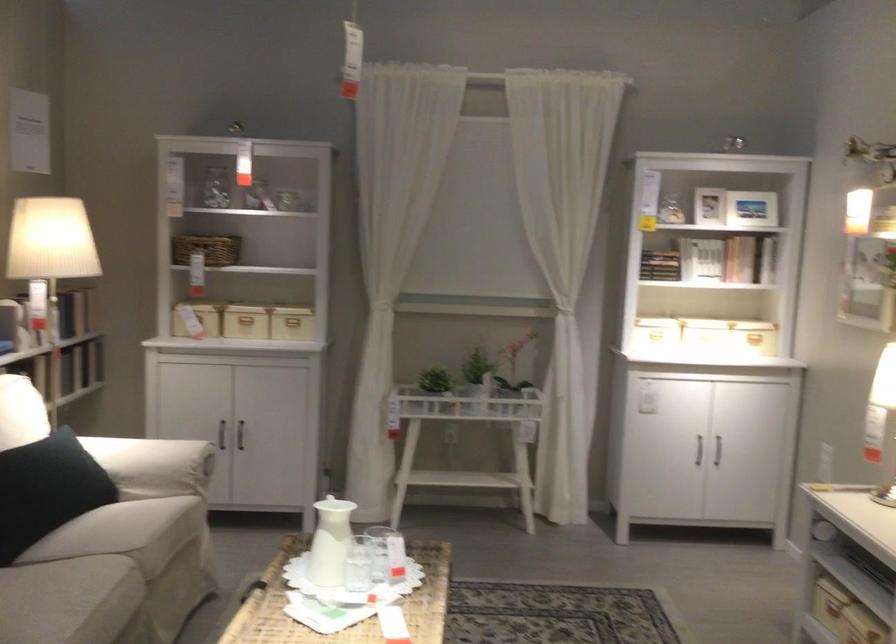
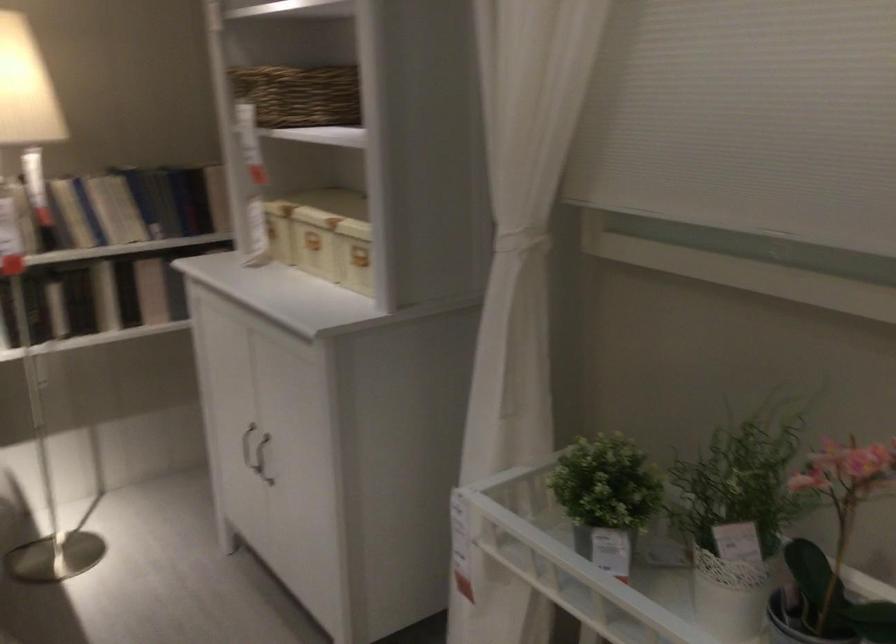
Find the pixel in the second image that matches point (76, 366) in the first image.

(151, 290)